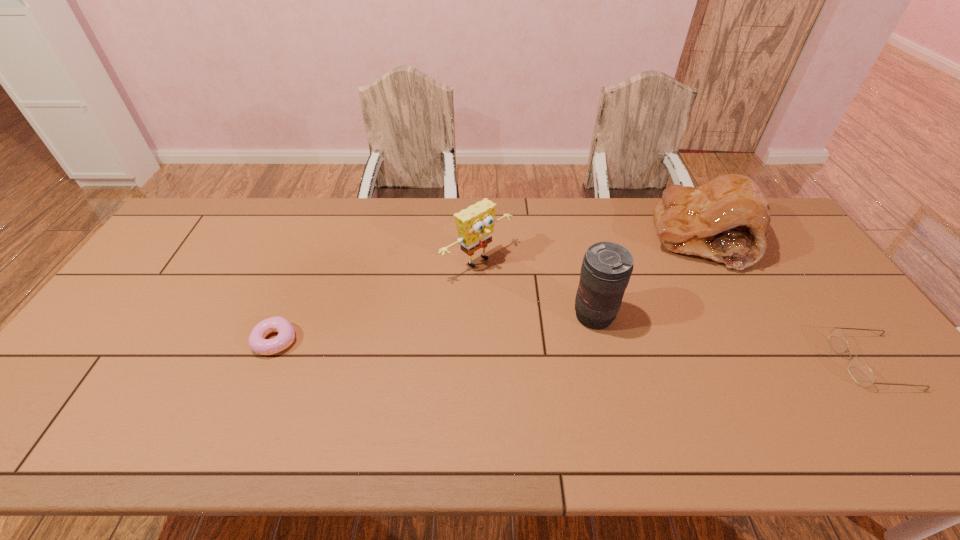
Find the location of `vacant region that satisfies the following two spatial constraints: 1. on the front side of the telephoto lens; 2. on the right side of the sponge`. vacant region that satisfies the following two spatial constraints: 1. on the front side of the telephoto lens; 2. on the right side of the sponge is located at coordinates (477, 316).

You are a GUI agent. You are given a task and a screenshot of the screen. Output one action in this format:
    pyautogui.click(x=<x>, y=<y>)
    Task: Click on the free space that satisfies the following two spatial constraints: 1. on the back side of the third object from left to right; 2. on the right side of the doughnut
    The width and height of the screenshot is (960, 540).
    Given the screenshot: What is the action you would take?
    pyautogui.click(x=285, y=316)